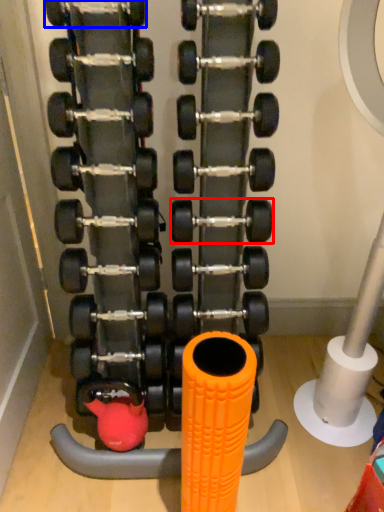
Question: Among these objects, which one is nearest to the camera, dumbbell (highlighted by a red box) or dumbbell (highlighted by a blue box)?

Choices:
 (A) dumbbell
 (B) dumbbell

Answer: (B)